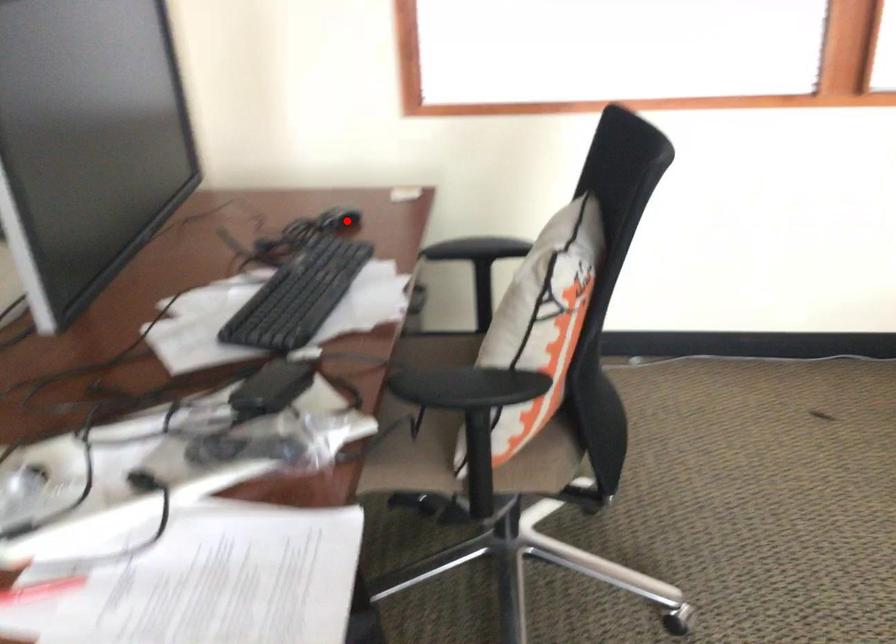
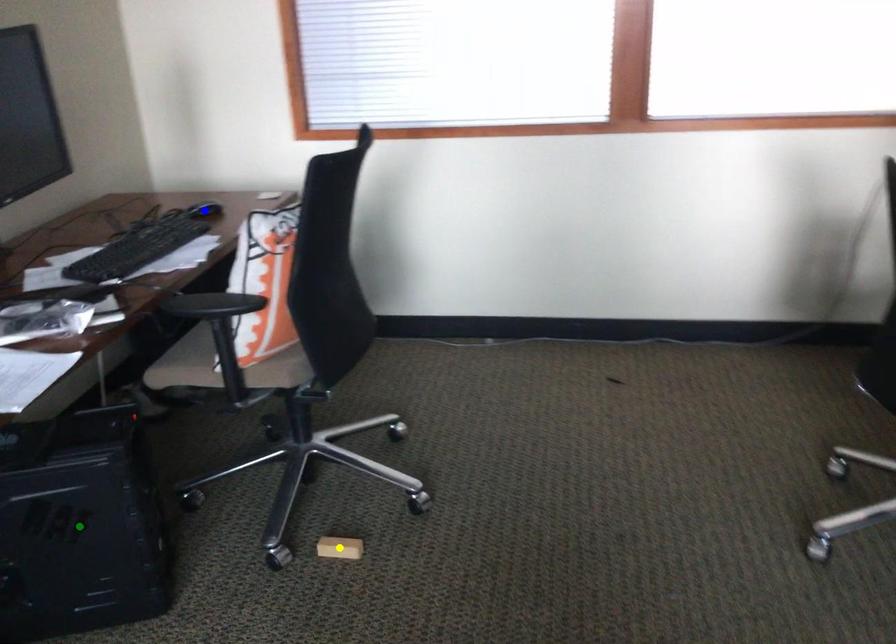
Question: I am providing you with two images of the same scene from different viewpoints. A red point is marked on the first image. You are given multiple points on the second image. Which point in image 2 represents the same 3d spot as the red point in image 1?

Choices:
 (A) blue point
 (B) green point
 (C) yellow point

Answer: (A)